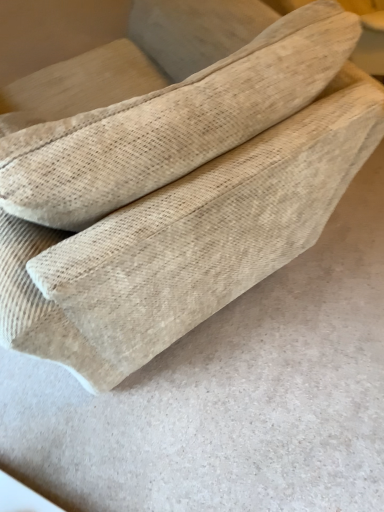
Find the location of a particular element. beige textured cushion at upper center is located at coordinates (172, 123).

Describe the element at coordinates (172, 123) in the screenshot. I see `beige textured cushion at upper center` at that location.

Image resolution: width=384 pixels, height=512 pixels. Find the location of `beige textured cushion at upper center`. beige textured cushion at upper center is located at coordinates (172, 123).